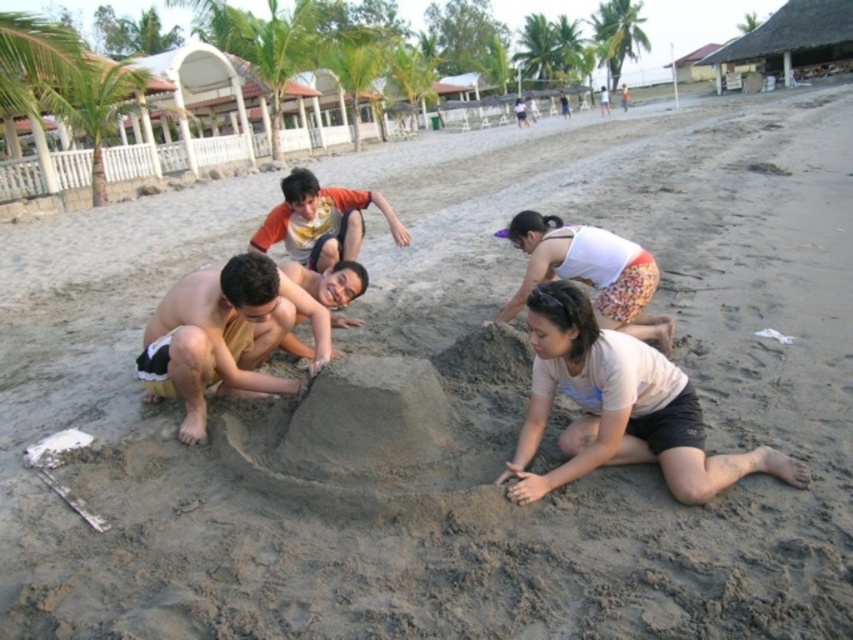
You are standing on the beach and want to take a photo of the sandcastle. The sandcastle is located at point (236, 388). If your camera can focus on objects within 4 meters, will it be able to capture the sandcastle clearly?

The distance of point (236, 388) from the viewer is 4.16 meters, which is slightly beyond the camera focus range of 4 meters. Therefore, the camera may not capture the sandcastle clearly.

You are standing at the center of the beach scene. Which direction should you move to reach the light beige cotton shirt at lower right?

You should move towards the lower right direction to reach the light beige cotton shirt at lower right since it is located at point (619,408) which is lower right in the image coordinate system.

You are a photographer standing behind the group to capture a photo of the tan skin man at center and the white cotton tank top at lower center. Which of them should you focus on first to ensure they are both in focus?

You should focus on the tan skin man at center first because he is closer to the viewer than the white cotton tank top at lower center, so adjusting focus starting from the closer object ensures both will be in focus.